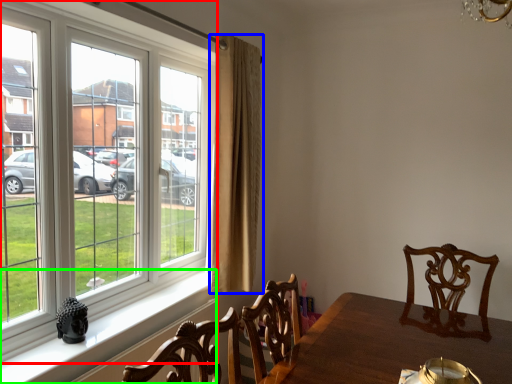
Question: Which is nearer to the window (highlighted by a red box)? curtain (highlighted by a blue box) or window sill (highlighted by a green box).

Choices:
 (A) curtain
 (B) window sill

Answer: (A)